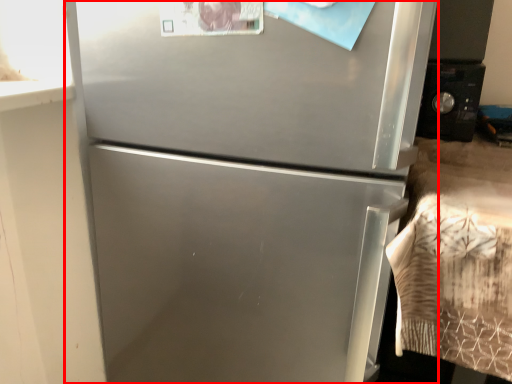
Question: From the image's perspective, what is the correct spatial relationship of refrigerator (annotated by the red box) in relation to appliance?

Choices:
 (A) above
 (B) below

Answer: (B)